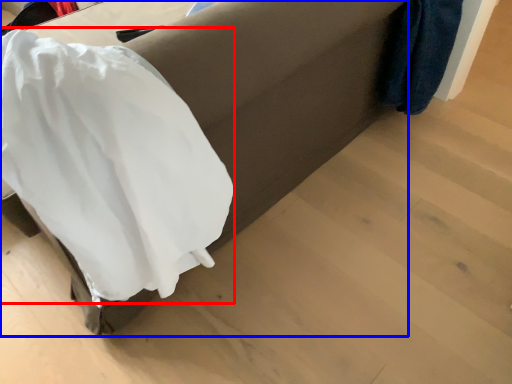
Question: Which of the following is the farthest to the observer, clothing (highlighted by a red box) or furniture (highlighted by a blue box)?

Choices:
 (A) clothing
 (B) furniture

Answer: (B)